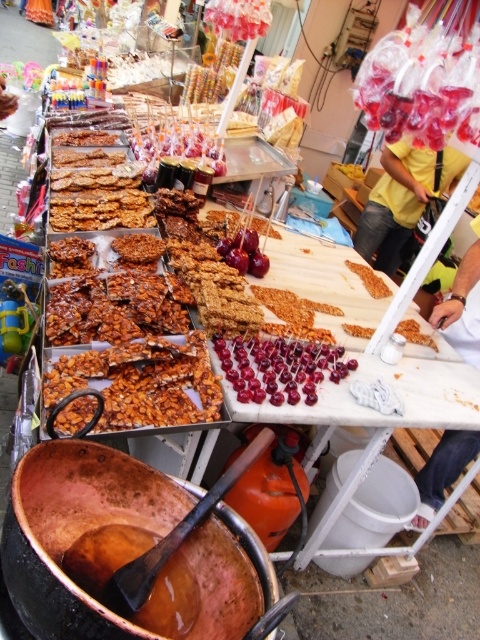
Question: Observing the image, what is the correct spatial positioning of yellow cotton shirt at upper right in reference to crunchy almond bar at center?

Choices:
 (A) below
 (B) above

Answer: (B)

Question: Does yellow cotton shirt at upper right appear under crunchy almond bar at center?

Choices:
 (A) yes
 (B) no

Answer: (B)

Question: Which of the following is the closest to the observer?

Choices:
 (A) (397, 152)
 (B) (368, 276)
 (C) (407, 321)

Answer: (C)

Question: Can you confirm if crispy golden nuts at center is smaller than crispy brown granola bar at center?

Choices:
 (A) no
 (B) yes

Answer: (A)

Question: Which object is the closest to the yellow cotton shirt at upper right?

Choices:
 (A) crunchy almond bar at center
 (B) crispy brown granola bar at center
 (C) crispy golden nuts at center
 (D) shiny red cherries at center

Answer: (B)

Question: Which point is closer to the camera?

Choices:
 (A) (127, 401)
 (B) (361, 332)

Answer: (A)